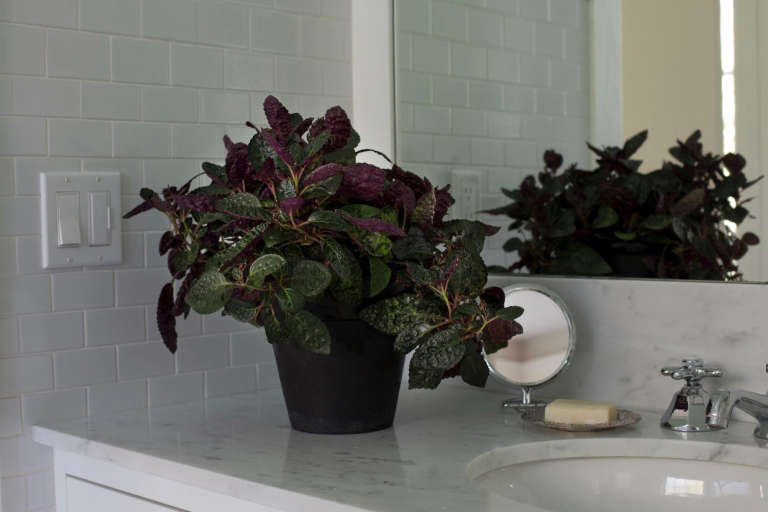
This screenshot has height=512, width=768. Find the location of `hot water knob`. hot water knob is located at coordinates (693, 369).